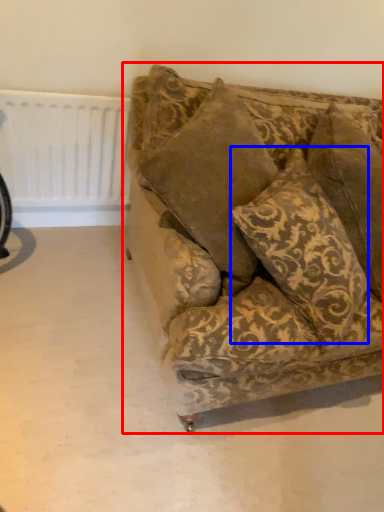
Question: Which object is further to the camera taking this photo, studio couch (highlighted by a red box) or pillow (highlighted by a blue box)?

Choices:
 (A) studio couch
 (B) pillow

Answer: (B)